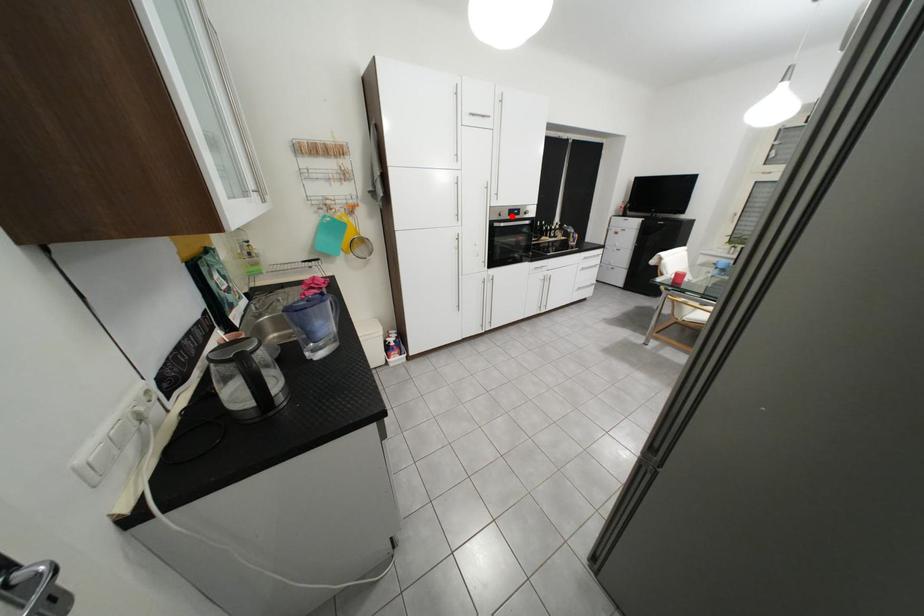
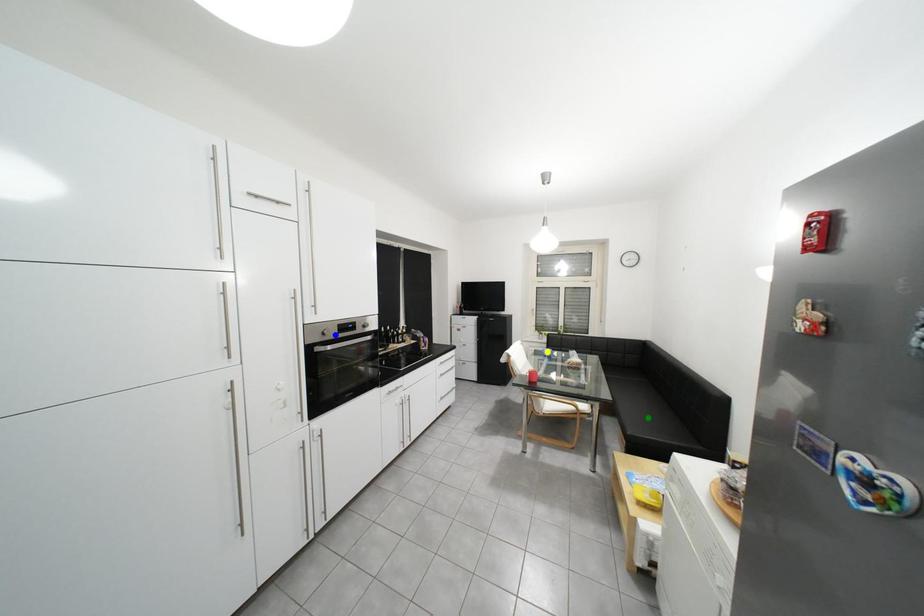
Question: I am providing you with two images of the same scene from different viewpoints. A red point is marked on the first image. You are given multiple points on the second image. Which point in image 2 is actually the same real-world point as the red point in image 1?

Choices:
 (A) blue point
 (B) green point
 (C) yellow point

Answer: (A)